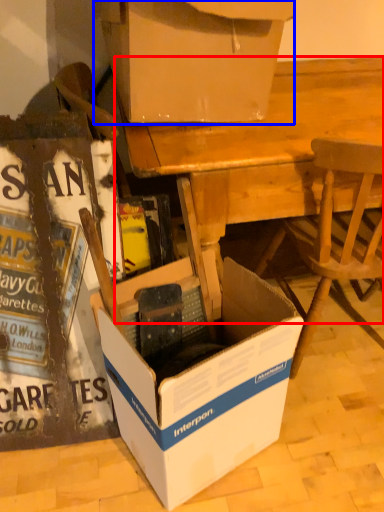
Question: Which object appears closest to the camera in this image, desk (highlighted by a red box) or box (highlighted by a blue box)?

Choices:
 (A) desk
 (B) box

Answer: (B)